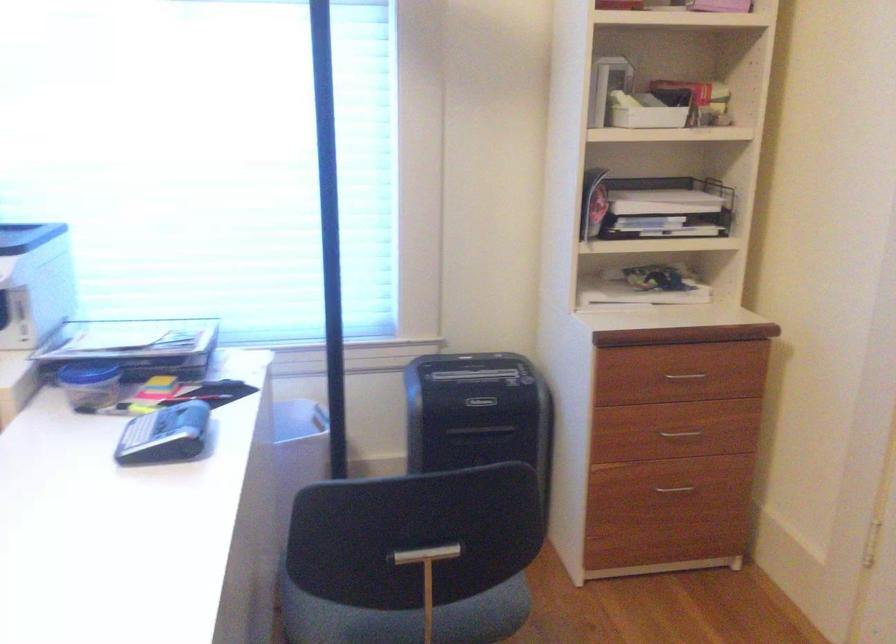
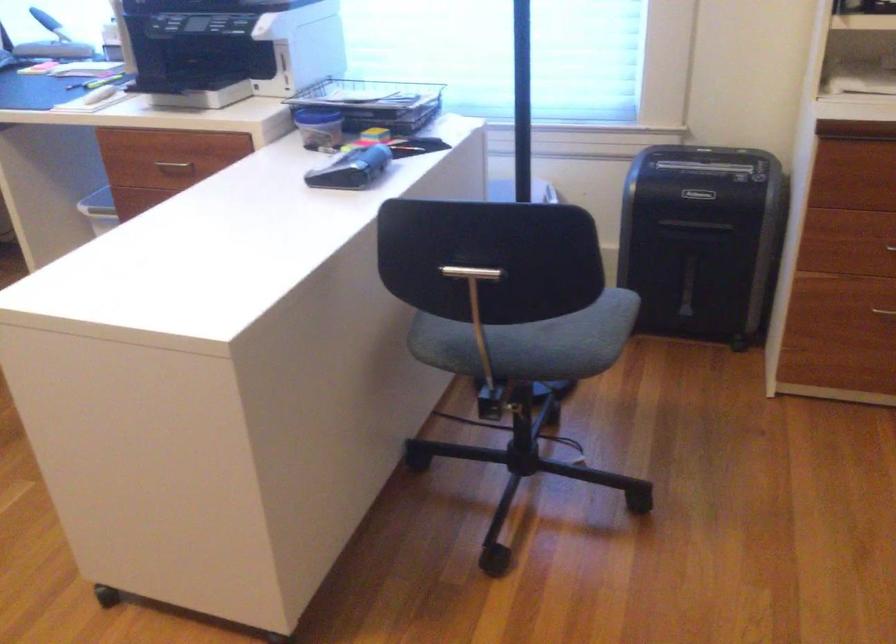
In the second image, find the point that corresponds to point 156,348 in the first image.

(374, 102)